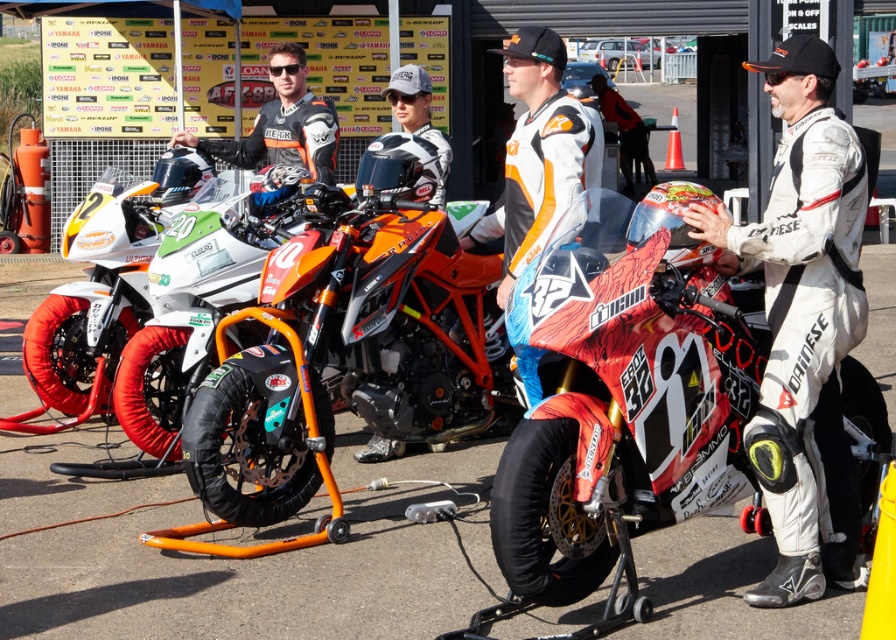
Can you confirm if white/textured suit at center is shorter than orange and white racing suit at center?

No.

Is point (856, 512) farther from viewer compared to point (502, 209)?

That is False.

Measure the distance between white/textured suit at center and camera.

4.84 meters

Locate an element on the screen. white/textured suit at center is located at coordinates (804, 324).

Which is more to the right, orange and white racing suit at center or matte black jacket at center?

orange and white racing suit at center is more to the right.

Locate an element on the screen. This screenshot has width=896, height=640. orange and white racing suit at center is located at coordinates (538, 152).

Consider the image. Is orange matte motorcycle at center thinner than orange and white racing suit at center?

No, orange matte motorcycle at center is not thinner than orange and white racing suit at center.

Which is in front, point (222, 456) or point (472, 240)?

Positioned in front is point (222, 456).

Is point (487, 353) less distant than point (498, 305)?

No, it is behind (498, 305).

You are a GUI agent. You are given a task and a screenshot of the screen. Output one action in this format:
    pyautogui.click(x=<x>, y=<y>)
    Task: Click on the orange matte motorcycle at center
    Image resolution: width=896 pixels, height=640 pixels.
    Given the screenshot: What is the action you would take?
    pyautogui.click(x=398, y=305)